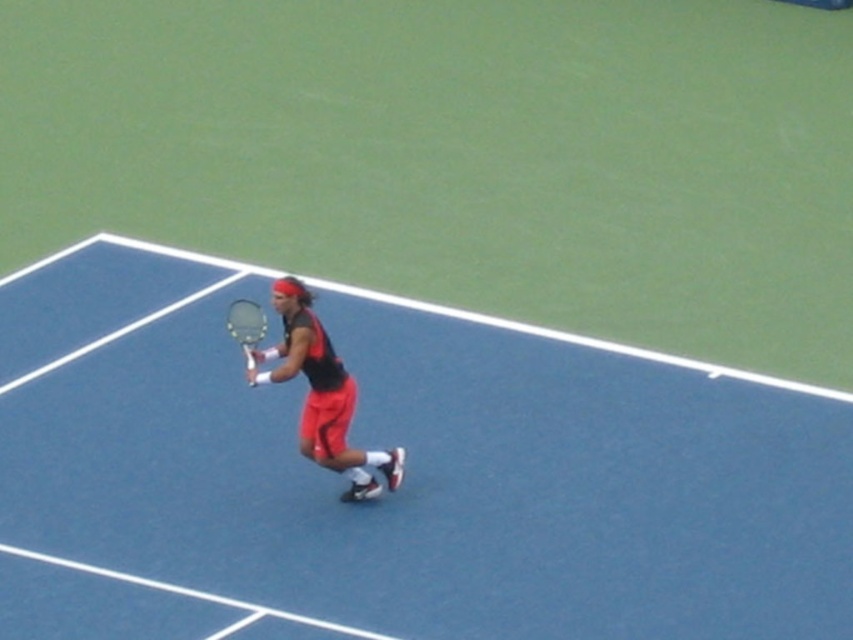
You are a tennis coach analyzing a player holding two rackets. You need to determine which racket is positioned lower. The rackets are the matte black tennis racket at center and the white glossy tennis racket at center. Which one is lower?

The matte black tennis racket at center is located below the white glossy tennis racket at center, so the matte black tennis racket at center is positioned lower.

You are a tennis instructor observing a player on the court. You need to explain the position of the blue rubber tennis court at center relative to the white glossy tennis racket at center. Which object is positioned lower in the image?

The blue rubber tennis court at center is located below the white glossy tennis racket at center, so the blue rubber tennis court at center is positioned lower in the image.

You are a tennis ball that just bounced on the blue rubber tennis court at center. You want to reach the matte black tennis racket at center before the player hits you. Can you make it if you can travel 1.2 meters in the air?

The distance between the blue rubber tennis court at center and the matte black tennis racket at center is 1.04 meters. Since you can travel 1.2 meters in the air, which is more than the required distance, you can reach the matte black tennis racket at center in time.